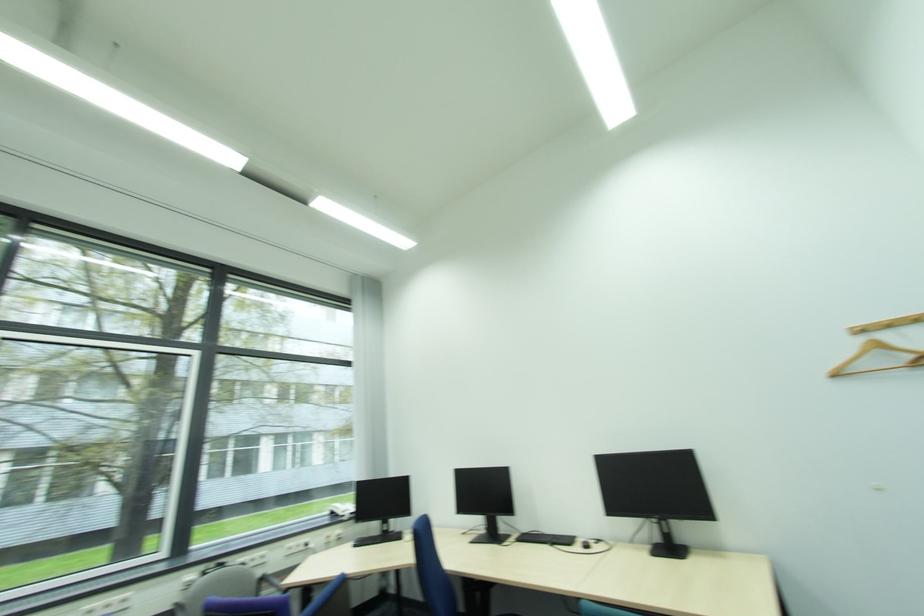
What do you see at coordinates (433, 572) in the screenshot? This screenshot has width=924, height=616. I see `the blue chair sitting surface` at bounding box center [433, 572].